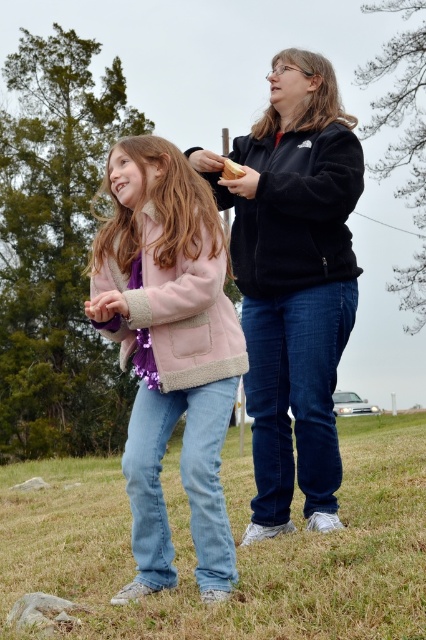
You are taking a photo of two people standing on a grassy area under an overcast sky. The first person is a young girl with a pink jacket and purple scarf, and the second is an adult woman in a black zip jacket. You notice two specific points in the image at coordinates point [267,212] and point [146,456]. Which of these two points is closer to your camera lens?

Point [267,212] is further to the camera than point [146,456], so the point closer to the camera is point [146,456].

Based on the scene description, where exactly is the blue jeans at lower center located in the image?

The blue jeans at lower center is located at point (x=236, y=550) in the image.

You are standing in the grassy area and want to place a small item exactly at the location marked by the blue jeans at lower center. What are the coordinates where you should place the item?

The coordinates for the blue jeans at lower center are at point (236, 550), so you should place the item there.